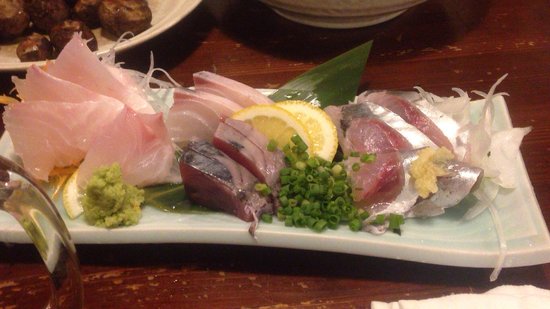
I want to click on plate, so click(x=520, y=219).